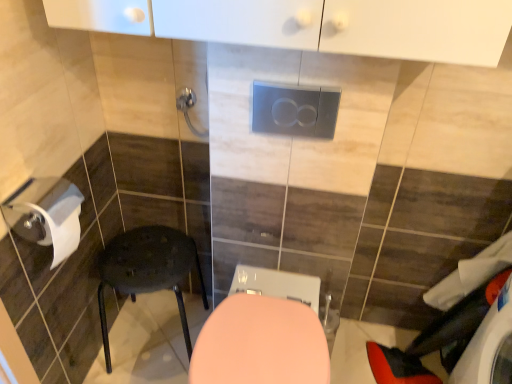
This screenshot has height=384, width=512. What are the coordinates of `white fabric laundry at lower right` in the screenshot? It's located at (471, 274).

What are the coordinates of `matte black stool at lower left` in the screenshot? It's located at coord(148,270).

This screenshot has width=512, height=384. Find the location of `white fabric laundry at lower right`. white fabric laundry at lower right is located at coordinates (471, 274).

Is pink glossy toilet at center positioned beyond the bounds of satin silver flush plate at center?

That's correct, pink glossy toilet at center is outside of satin silver flush plate at center.

In the scene shown: From the image's perspective, is pink glossy toilet at center beneath satin silver flush plate at center?

Yes.

Which point is more distant from viewer, (x=201, y=339) or (x=311, y=122)?

The point (x=201, y=339) is farther.

Are pink glossy toilet at center and satin silver flush plate at center far apart?

pink glossy toilet at center is near satin silver flush plate at center, not far away.

Is point (106, 255) closer or farther from the camera than point (186, 118)?

Point (106, 255) is farther from the camera than point (186, 118).

From the image's perspective, which one is positioned higher, matte black stool at lower left or metallic silver towel bar at upper center?

metallic silver towel bar at upper center is shown above in the image.

Can you confirm if matte black stool at lower left is wider than metallic silver towel bar at upper center?

Yes.

Considering the positions of objects matte black stool at lower left and metallic silver towel bar at upper center in the image provided, who is more to the right, matte black stool at lower left or metallic silver towel bar at upper center?

metallic silver towel bar at upper center is more to the right.

Considering the positions of objects white fabric laundry at lower right and metallic silver towel bar at upper center in the image provided, who is more to the right, white fabric laundry at lower right or metallic silver towel bar at upper center?

white fabric laundry at lower right.

Does white fabric laundry at lower right have a smaller size compared to metallic silver towel bar at upper center?

Incorrect, white fabric laundry at lower right is not smaller in size than metallic silver towel bar at upper center.

How far apart are white fabric laundry at lower right and metallic silver towel bar at upper center?

white fabric laundry at lower right is 3.36 feet from metallic silver towel bar at upper center.

Does white fabric laundry at lower right lie behind metallic silver towel bar at upper center?

Yes.

How far apart are metallic silver towel bar at upper center and satin silver flush plate at center?

A distance of 13.96 inches exists between metallic silver towel bar at upper center and satin silver flush plate at center.

Does metallic silver towel bar at upper center have a larger size compared to satin silver flush plate at center?

Indeed, metallic silver towel bar at upper center has a larger size compared to satin silver flush plate at center.

Does metallic silver towel bar at upper center come in front of satin silver flush plate at center?

That is False.

How many degrees apart are the facing directions of metallic silver towel bar at upper center and satin silver flush plate at center?

0.462 degrees separate the facing orientations of metallic silver towel bar at upper center and satin silver flush plate at center.

Identify the location of towel bar above the matte black stool at lower left (from the image's perspective). (188, 109).

Considering the relative positions of metallic silver towel bar at upper center and matte black stool at lower left in the image provided, is metallic silver towel bar at upper center in front of matte black stool at lower left?

No, the depth of metallic silver towel bar at upper center is greater than that of matte black stool at lower left.

Can you confirm if metallic silver towel bar at upper center is positioned to the left of matte black stool at lower left?

In fact, metallic silver towel bar at upper center is to the right of matte black stool at lower left.

Is point (193, 127) farther from camera compared to point (179, 279)?

No.

Which of these two, white fabric laundry at lower right or matte black stool at lower left, is wider?

Wider between the two is matte black stool at lower left.

Between white fabric laundry at lower right and matte black stool at lower left, which one has more height?

matte black stool at lower left is taller.

Considering the positions of objects white fabric laundry at lower right and matte black stool at lower left in the image provided, who is more to the right, white fabric laundry at lower right or matte black stool at lower left?

white fabric laundry at lower right.

Is the surface of white fabric laundry at lower right in direct contact with matte black stool at lower left?

white fabric laundry at lower right and matte black stool at lower left are clearly separated.

Is satin silver flush plate at center at the right side of pink glossy toilet at center?

Indeed, satin silver flush plate at center is positioned on the right side of pink glossy toilet at center.

In the scene shown: From the image's perspective, is satin silver flush plate at center on top of pink glossy toilet at center?

Yes, from the image's perspective, satin silver flush plate at center is on top of pink glossy toilet at center.

Is satin silver flush plate at center in front of or behind pink glossy toilet at center in the image?

satin silver flush plate at center is positioned farther from the viewer than pink glossy toilet at center.

I want to click on toilet that appears below the satin silver flush plate at center (from a real-world perspective), so click(260, 344).

At what (x,y) coordinates should I click in order to perform the action: click on towel bar behind the matte black stool at lower left. Please return your answer as a coordinate pair (x, y). Looking at the image, I should click on (188, 109).

Estimate the real-world distances between objects in this image. Which object is closer to satin silver flush plate at center, matte black stool at lower left or metallic silver towel bar at upper center?

Among the two, metallic silver towel bar at upper center is located nearer to satin silver flush plate at center.

Which object lies further to the anchor point white fabric laundry at lower right, matte black stool at lower left or pink glossy toilet at center?

Among the two, matte black stool at lower left is located further to white fabric laundry at lower right.

Estimate the real-world distances between objects in this image. Which object is further from satin silver flush plate at center, metallic silver towel bar at upper center or pink glossy toilet at center?

Based on the image, pink glossy toilet at center appears to be further to satin silver flush plate at center.

Estimate the real-world distances between objects in this image. Which object is further from satin silver flush plate at center, white fabric laundry at lower right or pink glossy toilet at center?

white fabric laundry at lower right.

From the image, which object appears to be farther from pink glossy toilet at center, metallic silver towel bar at upper center or matte black stool at lower left?

metallic silver towel bar at upper center.

From the image, which object appears to be nearer to matte black stool at lower left, pink glossy toilet at center or metallic silver towel bar at upper center?

pink glossy toilet at center.

Which object lies nearer to the anchor point metallic silver towel bar at upper center, satin silver flush plate at center or white fabric laundry at lower right?

Among the two, satin silver flush plate at center is located nearer to metallic silver towel bar at upper center.

From the picture: Considering their positions, is metallic silver towel bar at upper center positioned further to matte black stool at lower left than satin silver flush plate at center?

satin silver flush plate at center is positioned further to the anchor matte black stool at lower left.

I want to click on electric outlet between metallic silver towel bar at upper center and pink glossy toilet at center vertically, so click(294, 109).

The height and width of the screenshot is (384, 512). What are the coordinates of `electric outlet situated between metallic silver towel bar at upper center and white fabric laundry at lower right from left to right` in the screenshot? It's located at (294, 109).

Locate an element on the screen. This screenshot has width=512, height=384. toilet between matte black stool at lower left and white fabric laundry at lower right from left to right is located at coordinates (260, 344).

You are a GUI agent. You are given a task and a screenshot of the screen. Output one action in this format:
    pyautogui.click(x=<x>, y=<y>)
    Task: Click on the toilet between metallic silver towel bar at upper center and white fabric laundry at lower right in the horizontal direction
    Image resolution: width=512 pixels, height=384 pixels.
    Given the screenshot: What is the action you would take?
    pyautogui.click(x=260, y=344)